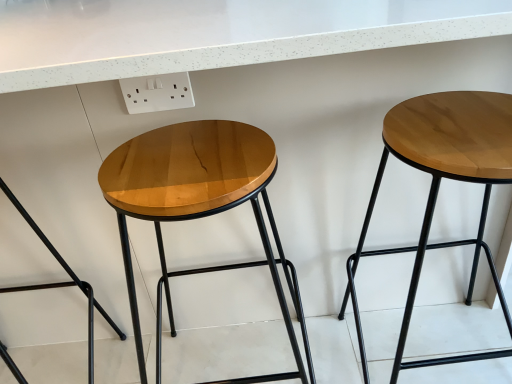
This screenshot has height=384, width=512. I want to click on vacant space situated above wooden stool at right, arranged as the first stool when viewed from the right (from a real-world perspective), so click(x=453, y=122).